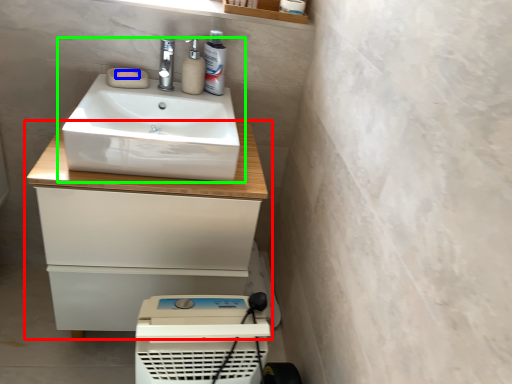
Question: Estimate the real-world distances between objects in this image. Which object is farther from bathroom cabinet (highlighted by a red box), soap (highlighted by a blue box) or sink (highlighted by a green box)?

Choices:
 (A) soap
 (B) sink

Answer: (A)